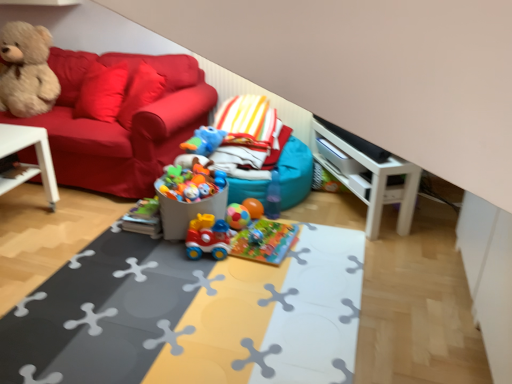
Question: Is the position of white glossy entertainment center at right more distant than that of white plastic table at left, which is counted as the 2th table, starting from the right?

Choices:
 (A) no
 (B) yes

Answer: (B)

Question: Is white glossy entertainment center at right oriented away from white plastic table at left, which is counted as the 2th table, starting from the right?

Choices:
 (A) no
 (B) yes

Answer: (A)

Question: Considering the relative sizes of white glossy entertainment center at right and white plastic table at left, which is the 1th table in left-to-right order, in the image provided, is white glossy entertainment center at right smaller than white plastic table at left, which is the 1th table in left-to-right order,?

Choices:
 (A) no
 (B) yes

Answer: (B)

Question: Is white glossy entertainment center at right shorter than white plastic table at left, which is counted as the 2th table, starting from the right?

Choices:
 (A) yes
 (B) no

Answer: (A)

Question: From the image's perspective, is white glossy entertainment center at right above white plastic table at left, which is the 1th table in left-to-right order?

Choices:
 (A) no
 (B) yes

Answer: (B)

Question: Is white glossy entertainment center at right oriented towards white plastic table at left, which is the 1th table in left-to-right order?

Choices:
 (A) yes
 (B) no

Answer: (A)

Question: Can you confirm if velvet teddy bear at left is positioned to the left of fluffy beige teddy bear at upper left?

Choices:
 (A) yes
 (B) no

Answer: (B)

Question: From the image's perspective, is velvet teddy bear at left on top of fluffy beige teddy bear at upper left?

Choices:
 (A) no
 (B) yes

Answer: (A)

Question: Does velvet teddy bear at left lie behind fluffy beige teddy bear at upper left?

Choices:
 (A) yes
 (B) no

Answer: (B)

Question: From the image's perspective, is velvet teddy bear at left below fluffy beige teddy bear at upper left?

Choices:
 (A) no
 (B) yes

Answer: (B)

Question: Is velvet teddy bear at left aimed at fluffy beige teddy bear at upper left?

Choices:
 (A) yes
 (B) no

Answer: (B)

Question: Can you confirm if velvet teddy bear at left is shorter than fluffy beige teddy bear at upper left?

Choices:
 (A) yes
 (B) no

Answer: (B)

Question: Is rubber duck at center, the 4th toy in the bottom-to-top sequence, positioned behind teal fabric bean bag at center?

Choices:
 (A) yes
 (B) no

Answer: (A)